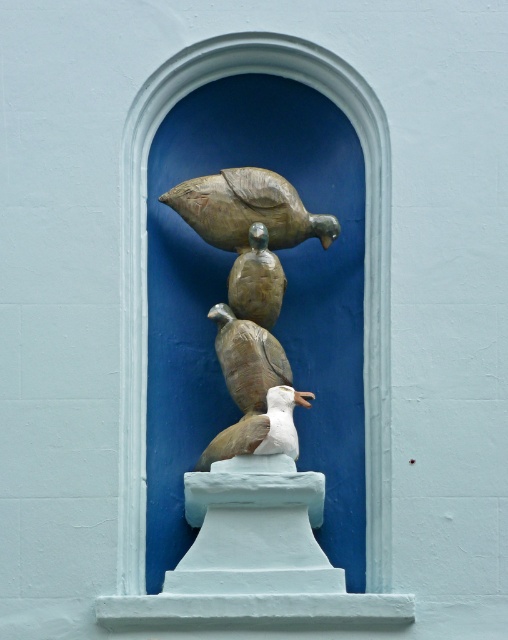
Between bronze textured bird at center and white matte bird at center, which one appears on the right side from the viewer's perspective?

From the viewer's perspective, white matte bird at center appears more on the right side.

Which is above, bronze textured bird at center or white matte bird at center?

Positioned higher is bronze textured bird at center.

The width and height of the screenshot is (508, 640). What do you see at coordinates (247, 209) in the screenshot? I see `bronze textured bird at center` at bounding box center [247, 209].

Identify the location of bronze textured bird at center. This screenshot has height=640, width=508. (247, 209).

Is bronze textured bird at center wider than matte brown bird at center?

No.

Does bronze textured bird at center appear on the right side of matte brown bird at center?

In fact, bronze textured bird at center is to the left of matte brown bird at center.

Locate an element on the screen. The height and width of the screenshot is (640, 508). bronze textured bird at center is located at coordinates (247, 209).

I want to click on bronze textured bird at center, so click(247, 209).

Find the location of `matte brown birds at center`. matte brown birds at center is located at coordinates (249, 291).

Is matte brown birds at center wider than bronze textured bird at center?

Yes, matte brown birds at center is wider than bronze textured bird at center.

You are a GUI agent. You are given a task and a screenshot of the screen. Output one action in this format:
    pyautogui.click(x=<x>, y=<y>)
    Task: Click on the matte brown birds at center
    The image size is (508, 640).
    Given the screenshot: What is the action you would take?
    (249, 291)